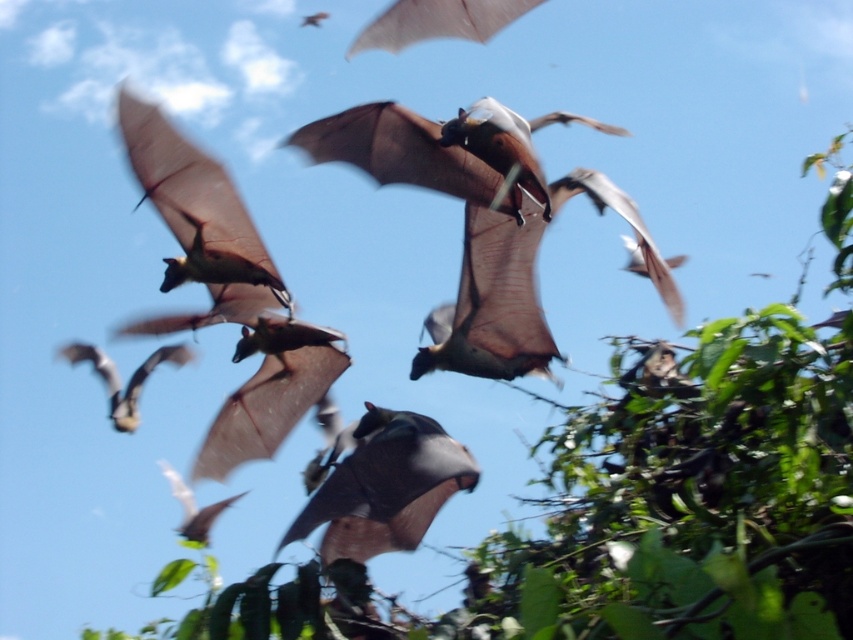
You are a bird flying in the sky and see the green leafy tree at center and the gray matte bat at center. Which object is positioned more to the right?

The green leafy tree at center is positioned more to the right than the gray matte bat at center.

You are standing on the ground and see the green leafy tree at center and the flying bats in the sky. Which object is closer to you?

The green leafy tree at center is closer to you than the flying bats in the sky because the distance between them is 7.13 feet, so the tree is nearer.

From the picture: You are a bird flying in the sky and want to land on a spot that is both near the gray matte bat at center and also near the green leafy tree at center. Which object should you approach first to be closer to both?

The gray matte bat at center is closer to the green leafy tree at center than itself, so you should approach the gray matte bat at center first to be closer to both.